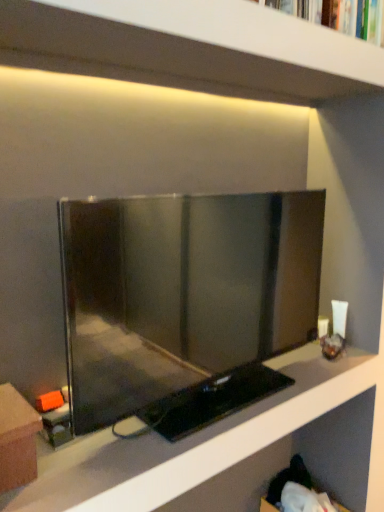
Question: Should I look upward or downward to see hardcover book at upper center?

Choices:
 (A) down
 (B) up

Answer: (B)

Question: Which direction should I rotate to look at matte black tv at center, arranged as the 1th shelf when ordered from the bottom, — up or down?

Choices:
 (A) down
 (B) up

Answer: (A)

Question: From the image's perspective, is matte black tv at center, arranged as the 1th shelf when ordered from the bottom, below white matte shelf at upper center, the first shelf in the top-to-bottom sequence?

Choices:
 (A) no
 (B) yes

Answer: (B)

Question: Considering the relative sizes of matte black tv at center, which is the 2th shelf in top-to-bottom order, and white matte shelf at upper center, which ranks as the 2th shelf in bottom-to-top order, in the image provided, is matte black tv at center, which is the 2th shelf in top-to-bottom order, smaller than white matte shelf at upper center, which ranks as the 2th shelf in bottom-to-top order,?

Choices:
 (A) yes
 (B) no

Answer: (B)

Question: Does matte black tv at center, arranged as the 1th shelf when ordered from the bottom, appear on the right side of white matte shelf at upper center, which ranks as the 2th shelf in bottom-to-top order?

Choices:
 (A) yes
 (B) no

Answer: (B)

Question: Is matte black tv at center, which is the 2th shelf in top-to-bottom order, far away from white matte shelf at upper center, which ranks as the 2th shelf in bottom-to-top order?

Choices:
 (A) no
 (B) yes

Answer: (A)

Question: Is matte black tv at center, arranged as the 1th shelf when ordered from the bottom, completely or partially outside of white matte shelf at upper center, the first shelf in the top-to-bottom sequence?

Choices:
 (A) yes
 (B) no

Answer: (A)

Question: From the image's perspective, would you say matte black tv at center, which is the 2th shelf in top-to-bottom order, is positioned over white matte shelf at upper center, the first shelf in the top-to-bottom sequence?

Choices:
 (A) no
 (B) yes

Answer: (A)

Question: From a real-world perspective, is hardcover book at upper center physically above white matte shelf at upper center, which ranks as the 2th shelf in bottom-to-top order?

Choices:
 (A) yes
 (B) no

Answer: (A)

Question: Could you tell me if hardcover book at upper center is turned towards white matte shelf at upper center, which ranks as the 2th shelf in bottom-to-top order?

Choices:
 (A) yes
 (B) no

Answer: (B)

Question: Considering the relative sizes of hardcover book at upper center and white matte shelf at upper center, which ranks as the 2th shelf in bottom-to-top order, in the image provided, is hardcover book at upper center taller than white matte shelf at upper center, which ranks as the 2th shelf in bottom-to-top order,?

Choices:
 (A) no
 (B) yes

Answer: (B)

Question: From the image's perspective, does hardcover book at upper center appear higher than white matte shelf at upper center, which ranks as the 2th shelf in bottom-to-top order?

Choices:
 (A) no
 (B) yes

Answer: (B)

Question: From the image's perspective, would you say hardcover book at upper center is shown under white matte shelf at upper center, the first shelf in the top-to-bottom sequence?

Choices:
 (A) no
 (B) yes

Answer: (A)

Question: Is hardcover book at upper center shorter than white matte shelf at upper center, which ranks as the 2th shelf in bottom-to-top order?

Choices:
 (A) no
 (B) yes

Answer: (A)

Question: Does white matte shelf at upper center, the first shelf in the top-to-bottom sequence, have a greater height compared to matte black tv at center, arranged as the 1th shelf when ordered from the bottom?

Choices:
 (A) yes
 (B) no

Answer: (A)